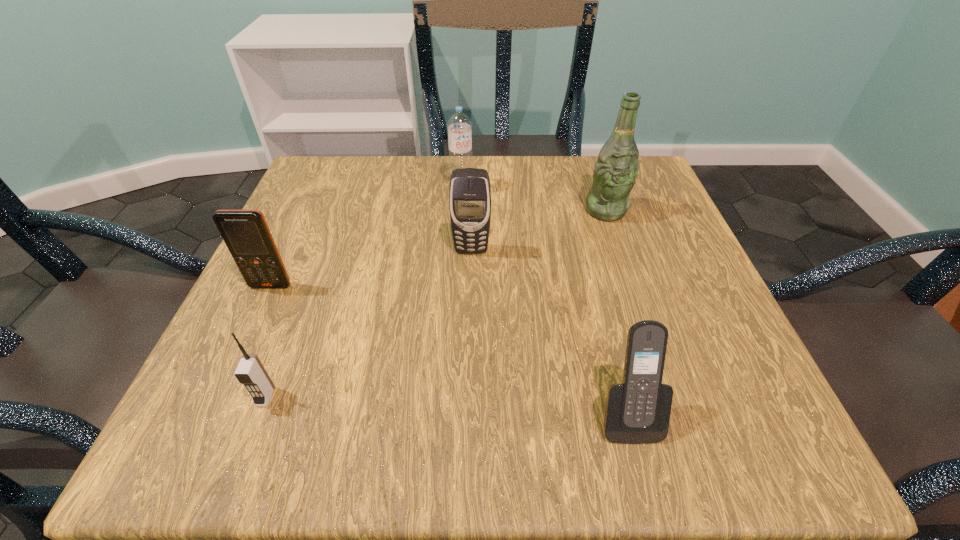
Identify which object is the second closest to the leftmost object. Please provide its 2D coordinates. Your answer should be formatted as a tuple, i.e. [(x, y)], where the tuple contains the x and y coordinates of a point satisfying the conditions above.

[(469, 195)]

Image resolution: width=960 pixels, height=540 pixels. Identify the location of cellular telephone identified as the third closest to the fifth nearest object. (246, 234).

I want to click on cellular telephone that is the closest to the fourth farthest object, so click(x=250, y=372).